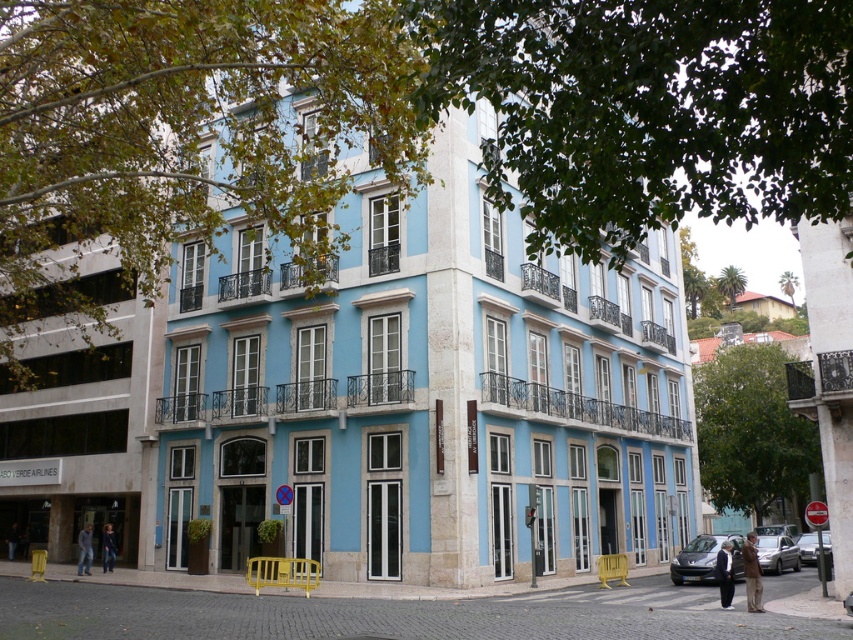
You are standing at the entrance of the building and see a brown leather jacket at lower right. There is a yellow metal barricade between you and the jacket. Can you reach the jacket without crossing the barricade?

The brown leather jacket at lower right is 18.75 meters away from the entrance. Since the barricade is between you and the jacket, you would need to go around it or cross the barricade to reach the jacket.

You are a tailor observing a couple walking on the sidewalk in front of the building. The man is wearing the dark gray suit at lower right and the woman is wearing the dark blue jeans at lower left. Which clothing item has a greater width?

The dark gray suit at lower right has a greater width than the dark blue jeans at lower left.

You are standing at the point marked as point (724, 573) in the image. What object is located at this point?

The dark gray suit at lower right is located at point (724, 573).